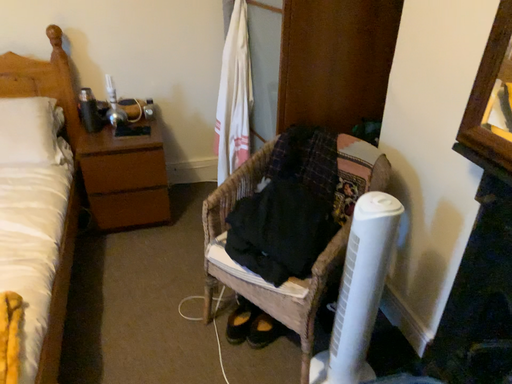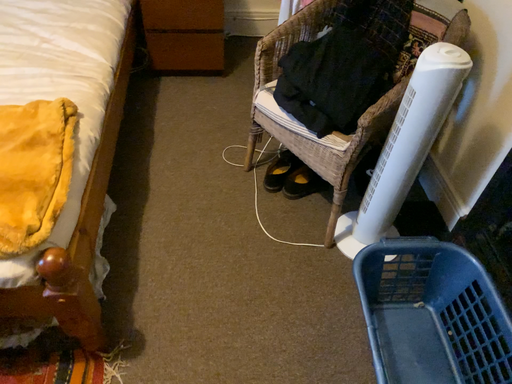
Question: How did the camera likely rotate when shooting the video?

Choices:
 (A) rotated right
 (B) rotated left

Answer: (B)